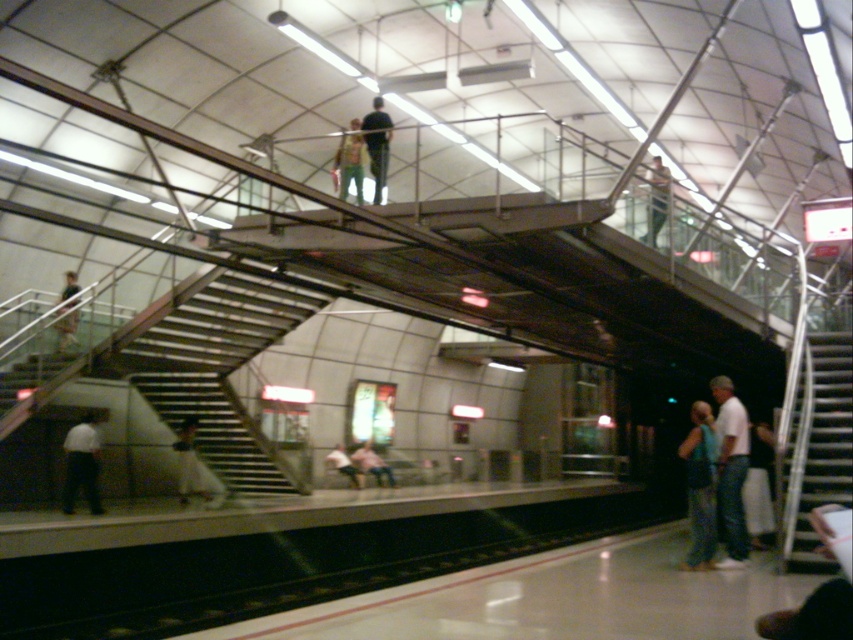
Question: Can you confirm if light brown leather jacket at upper left is positioned to the right of light pink fabric at lower center?

Choices:
 (A) no
 (B) yes

Answer: (A)

Question: Is the position of light brown leather jacket at upper left less distant than that of pink fabric at center?

Choices:
 (A) yes
 (B) no

Answer: (A)

Question: Which of the following is the closest to the observer?

Choices:
 (A) (834, 364)
 (B) (379, 113)
 (C) (715, 465)

Answer: (C)

Question: Which object appears closest to the camera in this image?

Choices:
 (A) light brown leather jacket at upper left
 (B) white cotton shirt at lower right

Answer: (B)

Question: Does denim pants at lower right appear on the left side of light pink fabric at lower center?

Choices:
 (A) yes
 (B) no

Answer: (B)

Question: Which point is closer to the camera taking this photo?

Choices:
 (A) (59, 296)
 (B) (357, 481)
 (C) (355, 145)

Answer: (C)